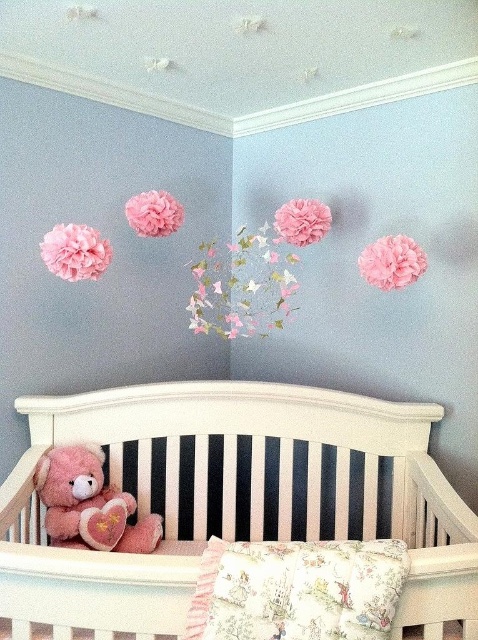
Question: Is pink paper flower at center below matte pink pom-pom at upper center?

Choices:
 (A) yes
 (B) no

Answer: (A)

Question: Can you confirm if fluffy pink teddy bear at center is positioned above matte pink pom-pom at upper center?

Choices:
 (A) no
 (B) yes

Answer: (A)

Question: Among these points, which one is nearest to the camera?

Choices:
 (A) (104, 516)
 (B) (398, 289)
 (C) (312, 211)
 (D) (228, 579)

Answer: (D)

Question: Which object appears closest to the camera in this image?

Choices:
 (A) matte pink pom-pom at upper left
 (B) pink fluffy pom-pom at upper right

Answer: (A)

Question: Which object is the farthest from the fluffy pink teddy bear at center?

Choices:
 (A) floral fabric pillow at bottom
 (B) pink paper flower at center

Answer: (B)

Question: Is floral fabric pillow at bottom bigger than pink fabric flower at upper center?

Choices:
 (A) yes
 (B) no

Answer: (B)